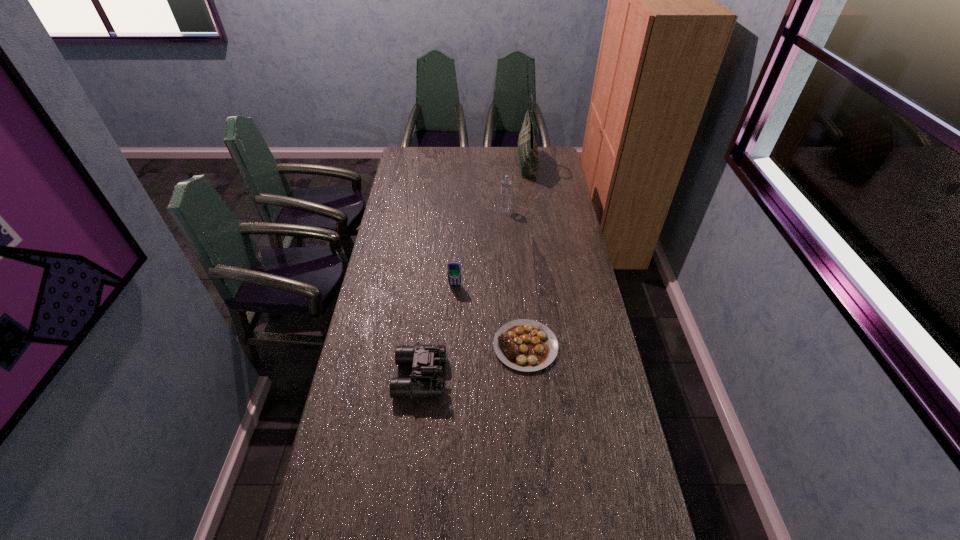
This screenshot has height=540, width=960. What are the coordinates of `free region located 0.070m through the lenses of the binoculars` in the screenshot? It's located at (467, 377).

This screenshot has width=960, height=540. What are the coordinates of `free space located 0.070m on the back of the steak` in the screenshot? It's located at (522, 307).

Identify the location of object at the far edge. (527, 148).

You are a GUI agent. You are given a task and a screenshot of the screen. Output one action in this format:
    pyautogui.click(x=<x>, y=<y>)
    Task: Click on the object located at the left edge
    The width and height of the screenshot is (960, 540).
    Given the screenshot: What is the action you would take?
    pyautogui.click(x=426, y=359)

Locate an element on the screen. The width and height of the screenshot is (960, 540). tote bag positioned at the right edge is located at coordinates (527, 148).

The height and width of the screenshot is (540, 960). What are the coordinates of `steak positioned at the right edge` in the screenshot? It's located at (526, 345).

Where is `object that is at the far right corner`? Image resolution: width=960 pixels, height=540 pixels. object that is at the far right corner is located at coordinates (527, 148).

Locate an element on the screen. The height and width of the screenshot is (540, 960). blank space at the far edge of the desktop is located at coordinates (493, 149).

Locate an element on the screen. This screenshot has width=960, height=540. vacant space at the left edge of the desktop is located at coordinates (375, 347).

In the image, there is a desktop. Where is `vacant space at the right edge`? vacant space at the right edge is located at coordinates (612, 538).